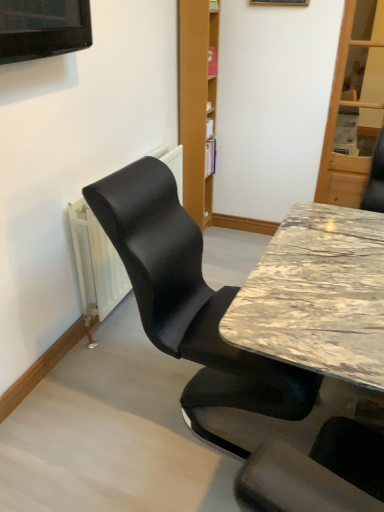
What is the approximate height of wooden bookshelf at upper center?

35.88 inches.

What are the coordinates of `wooden bookshelf at upper center` in the screenshot? It's located at (196, 101).

Can you confirm if black leather chair at left is bigger than metallic gold picture frame at upper center?

Yes.

Does black leather chair at left have a lesser width compared to metallic gold picture frame at upper center?

No.

Does point (184, 210) appear closer or farther from the camera than point (294, 0)?

Point (184, 210) appears to be farther away from the viewer than point (294, 0).

Considering their positions, is black leather chair at left located in front of or behind metallic gold picture frame at upper center?

In the image, black leather chair at left appears in front of metallic gold picture frame at upper center.

Is point (207, 352) closer to viewer compared to point (302, 284)?

No, it is behind (302, 284).

From a real-world perspective, which is physically below, black leather chair at left or marble table at center?

marble table at center is physically lower.

Looking at their sizes, would you say black leather chair at left is wider or thinner than marble table at center?

black leather chair at left is wider than marble table at center.

Is black leather chair at left in front of or behind marble table at center in the image?

black leather chair at left is behind marble table at center.

Considering the sizes of wooden bookshelf at upper center and metallic gold picture frame at upper center in the image, is wooden bookshelf at upper center wider or thinner than metallic gold picture frame at upper center?

Clearly, wooden bookshelf at upper center has more width compared to metallic gold picture frame at upper center.

Does wooden bookshelf at upper center have a lesser height compared to metallic gold picture frame at upper center?

Incorrect, the height of wooden bookshelf at upper center does not fall short of that of metallic gold picture frame at upper center.

From a real-world perspective, is wooden bookshelf at upper center located beneath metallic gold picture frame at upper center?

Yes, from a real-world perspective, wooden bookshelf at upper center is beneath metallic gold picture frame at upper center.

How many degrees apart are the facing directions of metallic gold picture frame at upper center and marble table at center?

The angular difference between metallic gold picture frame at upper center and marble table at center is 93.9 degrees.

Which of these two, metallic gold picture frame at upper center or marble table at center, stands taller?

Standing taller between the two is marble table at center.

Consider the image. Is metallic gold picture frame at upper center oriented towards marble table at center?

No, metallic gold picture frame at upper center is not oriented towards marble table at center.

From a real-world perspective, is metallic gold picture frame at upper center positioned above or below marble table at center?

From a real-world perspective, metallic gold picture frame at upper center is physically above marble table at center.

Is marble table at center facing away from black leather chair at left?

Yes, marble table at center is facing away from black leather chair at left.

From the image's perspective, relative to black leather chair at left, is marble table at center above or below?

marble table at center is situated lower than black leather chair at left in the image.

Which is nearer, [288,353] or [182,338]?

Point [288,353]

Who is bigger, marble table at center or black leather chair at left?

marble table at center.

Is metallic gold picture frame at upper center at the left side of wooden bookshelf at upper center?

No, metallic gold picture frame at upper center is not to the left of wooden bookshelf at upper center.

From a real-world perspective, is metallic gold picture frame at upper center located beneath wooden bookshelf at upper center?

No, from a real-world perspective, metallic gold picture frame at upper center is not beneath wooden bookshelf at upper center.

Is metallic gold picture frame at upper center looking in the opposite direction of wooden bookshelf at upper center?

metallic gold picture frame at upper center is not turned away from wooden bookshelf at upper center.

Would you say wooden bookshelf at upper center is part of metallic gold picture frame at upper center's contents?

Definitely not — wooden bookshelf at upper center is not inside metallic gold picture frame at upper center.

From the image's perspective, does marble table at center appear lower than wooden bookshelf at upper center?

Yes, from the image's perspective, marble table at center is beneath wooden bookshelf at upper center.

Is marble table at center in contact with wooden bookshelf at upper center?

No, marble table at center is not with wooden bookshelf at upper center.

From a real-world perspective, is marble table at center located higher than wooden bookshelf at upper center?

Incorrect, from a real-world perspective, marble table at center is lower than wooden bookshelf at upper center.

Locate an element on the screen. chair that is in front of the metallic gold picture frame at upper center is located at coordinates (189, 301).

Locate an element on the screen. chair lying above the marble table at center (from the image's perspective) is located at coordinates (189, 301).

Which object lies further to the anchor point metallic gold picture frame at upper center, wooden bookshelf at upper center or marble table at center?

marble table at center is further to metallic gold picture frame at upper center.

From the image, which object appears to be farther from black leather chair at left, metallic gold picture frame at upper center or wooden bookshelf at upper center?

The object further to black leather chair at left is metallic gold picture frame at upper center.

When comparing their distances from wooden bookshelf at upper center, does black leather chair at left or marble table at center seem closer?

The object closer to wooden bookshelf at upper center is black leather chair at left.

Which object lies nearer to the anchor point metallic gold picture frame at upper center, marble table at center or wooden bookshelf at upper center?

Based on the image, wooden bookshelf at upper center appears to be nearer to metallic gold picture frame at upper center.

Estimate the real-world distances between objects in this image. Which object is further from marble table at center, wooden bookshelf at upper center or metallic gold picture frame at upper center?

metallic gold picture frame at upper center lies further to marble table at center than the other object.

Looking at this image, which object lies further to the anchor point black leather chair at left, marble table at center or wooden bookshelf at upper center?

Among the two, wooden bookshelf at upper center is located further to black leather chair at left.

Which object lies nearer to the anchor point wooden bookshelf at upper center, metallic gold picture frame at upper center or marble table at center?

metallic gold picture frame at upper center is closer to wooden bookshelf at upper center.

Considering their positions, is black leather chair at left positioned closer to wooden bookshelf at upper center than metallic gold picture frame at upper center?

metallic gold picture frame at upper center.

What are the coordinates of `chair between marble table at center and wooden bookshelf at upper center along the z-axis` in the screenshot? It's located at tap(189, 301).

In order to click on bookshelf between metallic gold picture frame at upper center and marble table at center from top to bottom in this screenshot , I will do `click(196, 101)`.

Where is `chair between metallic gold picture frame at upper center and marble table at center in the vertical direction`? This screenshot has width=384, height=512. chair between metallic gold picture frame at upper center and marble table at center in the vertical direction is located at coordinates (189, 301).

This screenshot has width=384, height=512. I want to click on bookshelf between metallic gold picture frame at upper center and black leather chair at left in the vertical direction, so click(x=196, y=101).